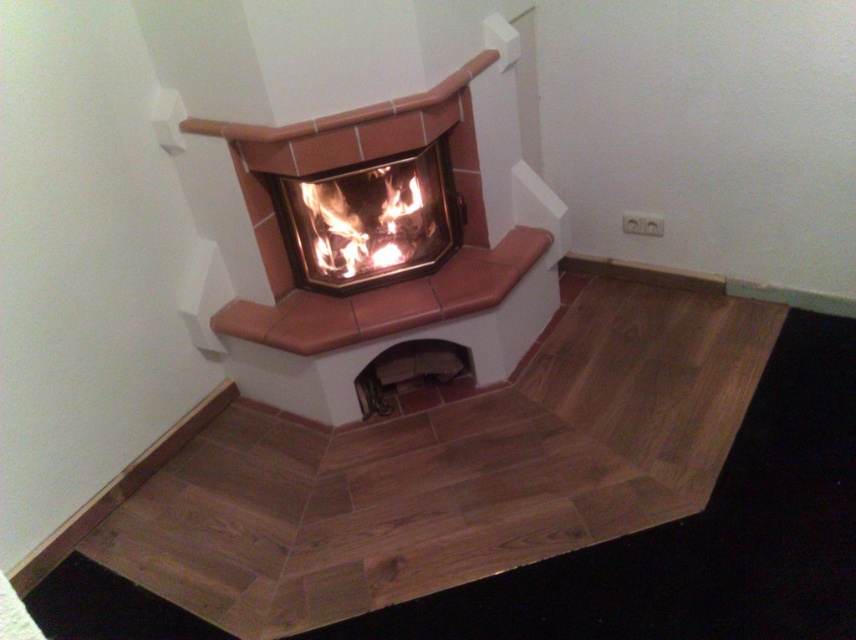
You are designing a layout for a room and need to place a large piece of furniture that requires a space larger than the matte ceramic fireplace at center. Can the metallic dark gray vent at lower center accommodate this furniture?

The matte ceramic fireplace at center is bigger than the metallic dark gray vent at lower center, so the metallic dark gray vent at lower center cannot accommodate the large furniture since it is smaller than the fireplace.

You are designing a safety barrier around the terracotta tile fireplace at center and the flaming wood at center. Since you need to account for their sizes, which object requires a wider barrier? Please explain your reasoning.

The terracotta tile fireplace at center requires a wider barrier because its width surpasses that of the flaming wood at center, as stated in the description.